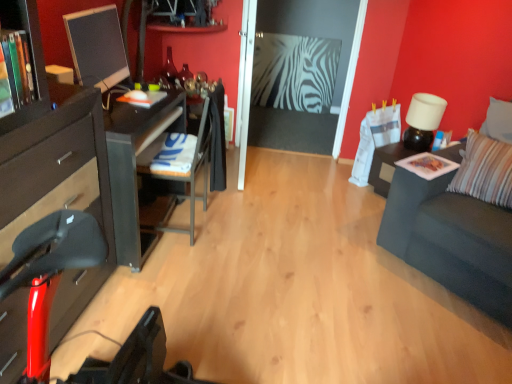
Question: Is wooden bookshelf at left at the back of white matte lamp at upper right?

Choices:
 (A) yes
 (B) no

Answer: (B)

Question: Can you confirm if white matte lamp at upper right is taller than wooden bookshelf at left?

Choices:
 (A) no
 (B) yes

Answer: (B)

Question: From the image's perspective, is white matte lamp at upper right over wooden bookshelf at left?

Choices:
 (A) no
 (B) yes

Answer: (B)

Question: Is white matte lamp at upper right outside of wooden bookshelf at left?

Choices:
 (A) yes
 (B) no

Answer: (A)

Question: Could wooden bookshelf at left be considered to be inside white matte lamp at upper right?

Choices:
 (A) no
 (B) yes

Answer: (A)

Question: From a real-world perspective, is matte black monitor at left physically located above or below wooden bookshelf at left?

Choices:
 (A) above
 (B) below

Answer: (B)

Question: From the image's perspective, relative to wooden bookshelf at left, is matte black monitor at left above or below?

Choices:
 (A) above
 (B) below

Answer: (A)

Question: Which is correct: matte black monitor at left is inside wooden bookshelf at left, or outside of it?

Choices:
 (A) outside
 (B) inside

Answer: (A)

Question: Visually, is matte black monitor at left positioned to the left or to the right of wooden bookshelf at left?

Choices:
 (A) left
 (B) right

Answer: (B)

Question: Choose the correct answer: Is metallic gray chair at center-left inside white matte lamp at upper right or outside it?

Choices:
 (A) inside
 (B) outside

Answer: (B)

Question: Does point (202, 119) appear closer or farther from the camera than point (428, 107)?

Choices:
 (A) farther
 (B) closer

Answer: (B)

Question: Is metallic gray chair at center-left to the left or to the right of white matte lamp at upper right in the image?

Choices:
 (A) left
 (B) right

Answer: (A)

Question: From a real-world perspective, relative to white matte lamp at upper right, is metallic gray chair at center-left vertically above or below?

Choices:
 (A) above
 (B) below

Answer: (B)

Question: Considering the positions of dark gray fabric couch at right and white matte lamp at upper right in the image, is dark gray fabric couch at right bigger or smaller than white matte lamp at upper right?

Choices:
 (A) small
 (B) big

Answer: (B)

Question: In the image, is dark gray fabric couch at right positioned in front of or behind white matte lamp at upper right?

Choices:
 (A) front
 (B) behind

Answer: (A)